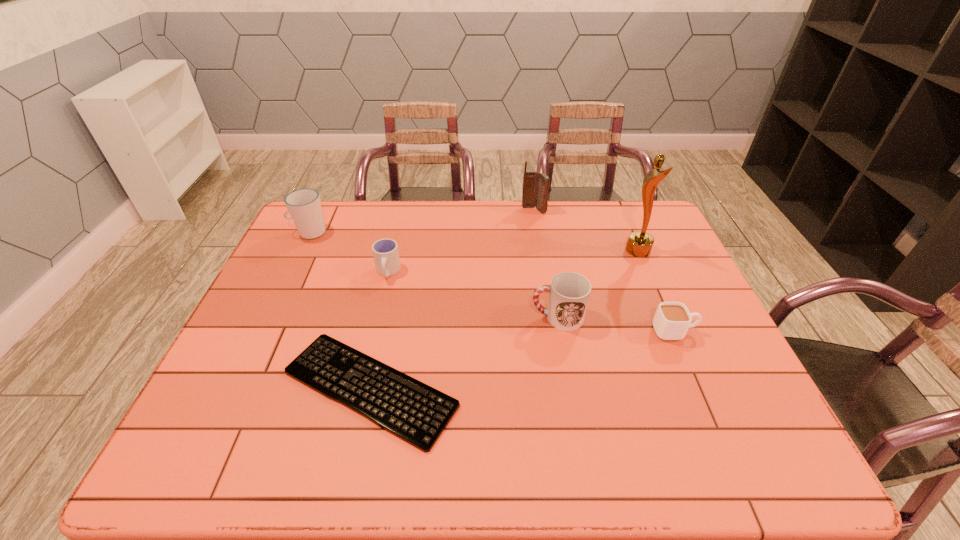
I want to click on the tallest object, so click(639, 244).

I want to click on the farthest object, so click(535, 185).

Identify the location of the second tallest object. Image resolution: width=960 pixels, height=540 pixels. (535, 185).

Locate an element on the screen. Image resolution: width=960 pixels, height=540 pixels. the leftmost cup is located at coordinates [x=304, y=206].

Identify the location of the leftmost object. This screenshot has width=960, height=540. (304, 206).

Identify the location of the fourth shortest object. (569, 292).

Where is `the second cup from right to left`? The image size is (960, 540). the second cup from right to left is located at coordinates (569, 292).

I want to click on the third cup from right to left, so click(385, 251).

I want to click on the second farthest cup, so pyautogui.click(x=385, y=251).

Locate an element on the screen. the shortest cup is located at coordinates (671, 321).